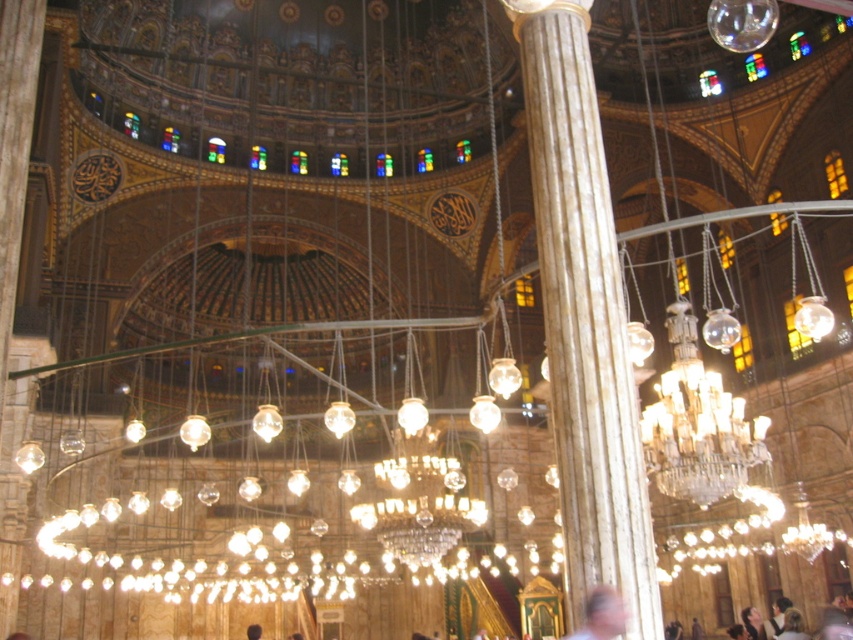
Looking at this image, you are a photographer standing in the grand mosque and want to capture a photo that includes both the blonde hair at center and the smooth skin face at lower right. Given that your camera has a maximum focus range of 6 meters, will you be able to capture both subjects in focus?

The blonde hair at center is 6.18 meters from the smooth skin face at lower right, which exceeds the camera maximum focus range of 6 meters. Therefore, you cannot capture both subjects in focus.

You are a photographer trying to capture the intricate details of the mosque. You notice two elements at the center of your viewfinder, the blurred skin at center and the blonde hair at center. Which of these two elements appears smaller in your current frame?

The blurred skin at center appears smaller compared to the blonde hair at center in the current frame.

You are a photographer taking a picture of the mosque interior. You notice the blonde hair at center and the smooth skin face at lower right. Which object should you focus on first if you want to capture both in the same frame?

You should focus on the smooth skin face at lower right first because the blonde hair at center is positioned to the left of it, so adjusting focus from the face to the hair would ensure both are in the frame.